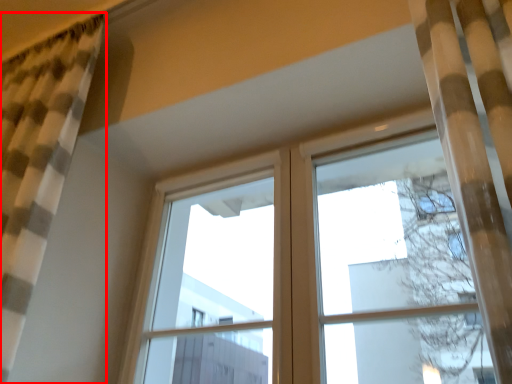
Question: From the image's perspective, what is the correct spatial positioning of curtain (annotated by the red box) in reference to window frame?

Choices:
 (A) below
 (B) above

Answer: (B)